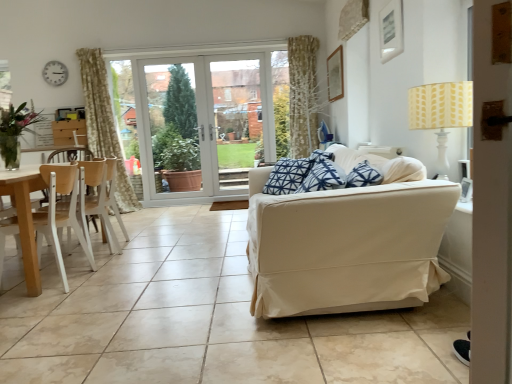
Describe the element at coordinates (55, 73) in the screenshot. I see `white plastic clock at upper left` at that location.

Measure the distance between beige fabric couch at right and camera.

They are 1.87 meters apart.

What do you see at coordinates (347, 245) in the screenshot?
I see `beige fabric couch at right` at bounding box center [347, 245].

This screenshot has width=512, height=384. What are the coordinates of `blue printed fabric pillow at center` in the screenshot? It's located at (323, 176).

Where is `white plastic clock at upper left`? This screenshot has height=384, width=512. white plastic clock at upper left is located at coordinates (55, 73).

Is beige ceramic tile at center inside or outside of white glass door at center?

beige ceramic tile at center cannot be found inside white glass door at center.

Which object is more forward, beige ceramic tile at center or white glass door at center?

beige ceramic tile at center.

Is there a large distance between beige ceramic tile at center and white glass door at center?

Absolutely, beige ceramic tile at center is distant from white glass door at center.

From the image's perspective, which is above, beige ceramic tile at center or white glass door at center?

white glass door at center is shown above in the image.

Between transparent glass door at center and clear glass vase at left, which one has more height?

transparent glass door at center is taller.

In the scene shown: Is transparent glass door at center in front of or behind clear glass vase at left in the image?

transparent glass door at center is positioned farther from the viewer than clear glass vase at left.

Between transparent glass door at center and clear glass vase at left, which one appears on the right side from the viewer's perspective?

transparent glass door at center.

Considering the relative sizes of transparent glass door at center and clear glass vase at left in the image provided, is transparent glass door at center thinner than clear glass vase at left?

Correct, the width of transparent glass door at center is less than that of clear glass vase at left.

The image size is (512, 384). Identify the location of plant above the beige ceramic tile at center (from the image's perspective). (15, 132).

Which of these two, clear glass vase at left or beige ceramic tile at center, is wider?

Wider between the two is beige ceramic tile at center.

Considering the sizes of objects clear glass vase at left and beige ceramic tile at center in the image provided, who is taller, clear glass vase at left or beige ceramic tile at center?

With more height is clear glass vase at left.

From the image's perspective, which is below, clear glass vase at left or beige ceramic tile at center?

beige ceramic tile at center, from the image's perspective.

Does blue printed fabric pillow at center lie in front of white glass door at center?

Yes, it is in front of white glass door at center.

Is blue printed fabric pillow at center next to white glass door at center and touching it?

No, blue printed fabric pillow at center is not making contact with white glass door at center.

From the image's perspective, which one is positioned higher, blue printed fabric pillow at center or white glass door at center?

white glass door at center appears higher in the image.

Is point (224, 73) in front of point (7, 152)?

No, it is behind (7, 152).

How many degrees apart are the facing directions of white glass door at center and clear glass vase at left?

89 degrees.

Is white glass door at center bigger or smaller than clear glass vase at left?

Considering their sizes, white glass door at center takes up more space than clear glass vase at left.

Does white glass door at center lie in front of clear glass vase at left?

No.

Consider the image. Is yellow printed fabric lampshade at upper right in front of or behind light wood/wooden chair at left, which appears as the second chair when viewed from the back, in the image?

In the image, yellow printed fabric lampshade at upper right appears in front of light wood/wooden chair at left, which appears as the second chair when viewed from the back.

From a real-world perspective, is yellow printed fabric lampshade at upper right above or below light wood/wooden chair at left, positioned as the 1th chair in front-to-back order?

In terms of real-world spatial position, yellow printed fabric lampshade at upper right is above light wood/wooden chair at left, positioned as the 1th chair in front-to-back order.

Is yellow printed fabric lampshade at upper right next to light wood/wooden chair at left, which appears as the second chair when viewed from the back, and touching it?

No.

Which object is positioned more to the left, yellow printed fabric lampshade at upper right or light wood/wooden chair at left, positioned as the 1th chair in front-to-back order?

Positioned to the left is light wood/wooden chair at left, positioned as the 1th chair in front-to-back order.

Which is closer to the camera, (53, 79) or (11, 132)?

Positioned in front is point (11, 132).

Is white plastic clock at upper left placed right next to clear glass vase at left?

No, white plastic clock at upper left is not beside clear glass vase at left.

How different are the orientations of white plastic clock at upper left and clear glass vase at left in degrees?

88.8 degrees.

The height and width of the screenshot is (384, 512). I want to click on door above the beige ceramic tile at center (from the image's perspective), so click(212, 115).

The image size is (512, 384). In order to click on plant located underneath the transparent glass door at center (from a real-world perspective) in this screenshot , I will do (x=15, y=132).

Considering their positions, is wooden chair at left, acting as the 1th chair starting from the back, positioned further to white plastic clock at upper left than blue printed fabric pillow at center?

blue printed fabric pillow at center is further to white plastic clock at upper left.

Based on their spatial positions, is beige ceramic tile at center or beige fabric couch at right closer to blue printed fabric pillow at center?

Based on the image, beige fabric couch at right appears to be nearer to blue printed fabric pillow at center.

Estimate the real-world distances between objects in this image. Which object is closer to clear glass vase at left, blue printed fabric pillow at center or white plastic clock at upper left?

white plastic clock at upper left is closer to clear glass vase at left.

Considering their positions, is transparent glass door at center positioned further to yellow printed fabric lampshade at upper right than blue printed fabric pillow at center?

Among the two, transparent glass door at center is located further to yellow printed fabric lampshade at upper right.

Consider the image. Which object lies further to the anchor point clear glass vase at left, yellow printed fabric lampshade at upper right or blue printed fabric pillow at center?

yellow printed fabric lampshade at upper right is further to clear glass vase at left.

Estimate the real-world distances between objects in this image. Which object is further from clear glass vase at left, wooden chair at left, the 2th chair from the front, or beige fabric couch at right?

beige fabric couch at right lies further to clear glass vase at left than the other object.

Considering their positions, is light wood/wooden chair at left, which appears as the second chair when viewed from the back, positioned closer to beige fabric couch at right than transparent glass door at center?

light wood/wooden chair at left, which appears as the second chair when viewed from the back, is closer to beige fabric couch at right.

Considering their positions, is yellow printed fabric lampshade at upper right positioned further to light wood/wooden chair at left, which appears as the second chair when viewed from the back, than clear glass vase at left?

The object further to light wood/wooden chair at left, which appears as the second chair when viewed from the back, is yellow printed fabric lampshade at upper right.

Where is `clock positioned between wooden chair at left, acting as the 1th chair starting from the back, and white glass door at center from near to far`? clock positioned between wooden chair at left, acting as the 1th chair starting from the back, and white glass door at center from near to far is located at coordinates (55, 73).

Locate an element on the screen. The width and height of the screenshot is (512, 384). window screen between light wood/wooden chair at left, positioned as the 1th chair in front-to-back order, and white glass door at center, along the z-axis is located at coordinates (239, 118).

I want to click on ceramic tile situated between light wood/wooden chair at left, which appears as the second chair when viewed from the back, and beige fabric couch at right from left to right, so click(x=204, y=318).

Identify the location of plant positioned between beige fabric couch at right and transparent glass door at center from near to far. Image resolution: width=512 pixels, height=384 pixels. (15, 132).